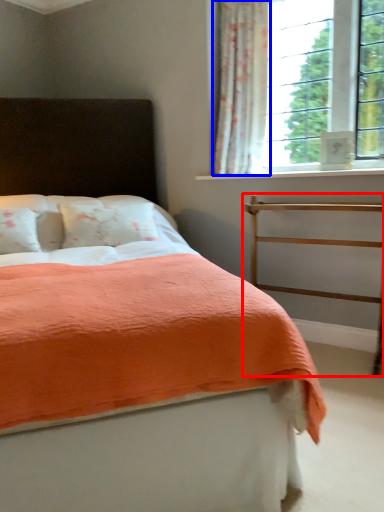
Question: Which of the following is the closest to the observer, balustrade (highlighted by a red box) or curtain (highlighted by a blue box)?

Choices:
 (A) balustrade
 (B) curtain

Answer: (A)